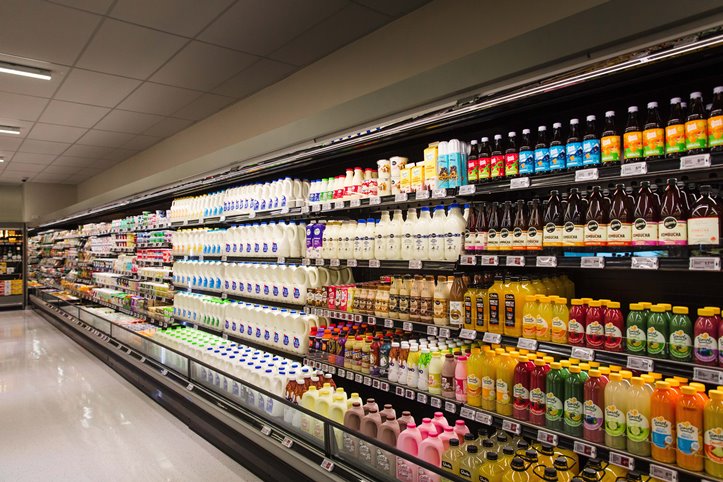
This screenshot has height=482, width=723. What are the coordinates of `shelves of iced tea` in the screenshot? It's located at (609, 215), (591, 152).